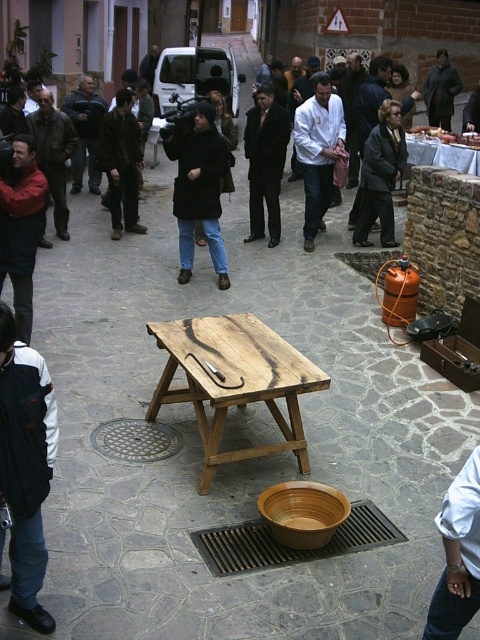
Question: Observing the image, what is the correct spatial positioning of brown matte bowl at center in reference to dark brown leather jacket at left?

Choices:
 (A) right
 (B) left

Answer: (A)

Question: Which of the following is the closest to the observer?

Choices:
 (A) (148, 83)
 (B) (149, 138)

Answer: (B)

Question: Among these objects, which one is nearest to the camera?

Choices:
 (A) black fuzzy coat at center
 (B) wooden picnic table at center

Answer: (B)

Question: Is black fuzzy coat at center positioned in front of dark brown leather jacket at center?

Choices:
 (A) no
 (B) yes

Answer: (B)

Question: Which object is farther from the camera taking this photo?

Choices:
 (A) black wool coat at center
 (B) wooden picnic table at center
 (C) dark gray jacket at center

Answer: (C)

Question: Is dark brown leather jacket at left positioned behind dark gray jacket at center?

Choices:
 (A) no
 (B) yes

Answer: (A)